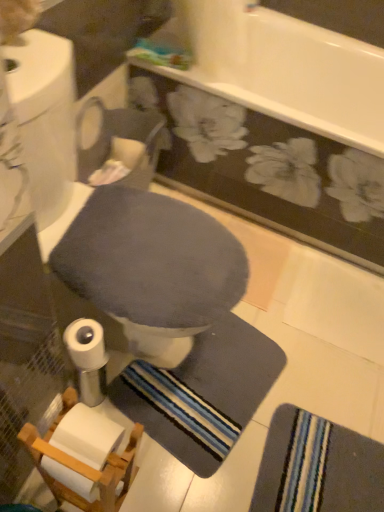
What do you see at coordinates (146, 269) in the screenshot?
I see `dark gray fabric toilet bowl at center` at bounding box center [146, 269].

Locate an element on the screen. The image size is (384, 512). dark gray fabric toilet bowl at center is located at coordinates (146, 269).

Where is `striped fabric bath towel at lower right`? The width and height of the screenshot is (384, 512). striped fabric bath towel at lower right is located at coordinates tap(317, 467).

Describe the element at coordinates (317, 467) in the screenshot. I see `striped fabric bath towel at lower right` at that location.

Identify the location of dark gray fabric toilet bowl at center. (146, 269).

Which is more to the right, striped fabric bath towel at lower right or dark gray fabric toilet bowl at center?

Positioned to the right is striped fabric bath towel at lower right.

Considering the positions of objects striped fabric bath towel at lower right and dark gray fabric toilet bowl at center in the image provided, who is in front, striped fabric bath towel at lower right or dark gray fabric toilet bowl at center?

Positioned in front is dark gray fabric toilet bowl at center.

Which point is more forward, (356,460) or (153,330)?

The point (153,330) is in front.

From the image's perspective, relative to dark gray fabric toilet bowl at center, is striped fabric bath towel at lower right above or below?

striped fabric bath towel at lower right is below dark gray fabric toilet bowl at center.

From a real-world perspective, is striped fabric bath towel at lower right over dark gray fabric toilet bowl at center?

No, from a real-world perspective, striped fabric bath towel at lower right is not on top of dark gray fabric toilet bowl at center.

Which object is thinner, striped fabric bath towel at lower right or dark gray fabric toilet bowl at center?

striped fabric bath towel at lower right.

Is striped fabric bath towel at lower right taller than dark gray fabric toilet bowl at center?

No.

Considering the sizes of objects striped fabric bath towel at lower right and dark gray fabric toilet bowl at center in the image provided, who is smaller, striped fabric bath towel at lower right or dark gray fabric toilet bowl at center?

striped fabric bath towel at lower right.

Could dark gray fabric toilet bowl at center be considered to be inside striped fabric bath towel at lower right?

No, dark gray fabric toilet bowl at center is not a part of striped fabric bath towel at lower right.

Is the surface of striped fabric bath towel at lower right in direct contact with dark gray fabric toilet bowl at center?

No, striped fabric bath towel at lower right is not in contact with dark gray fabric toilet bowl at center.

Looking at this image, is dark gray fabric toilet bowl at center at the back of striped fabric bath towel at lower right?

No, striped fabric bath towel at lower right is not facing away from dark gray fabric toilet bowl at center.

Can you tell me how much striped fabric bath towel at lower right and dark gray fabric toilet bowl at center differ in facing direction?

striped fabric bath towel at lower right and dark gray fabric toilet bowl at center are facing 179 degrees away from each other.

Locate an element on the screen. The width and height of the screenshot is (384, 512). toilet bowl on the left of striped fabric bath towel at lower right is located at coordinates (146, 269).

Does dark gray fabric toilet bowl at center appear on the left side of striped fabric bath towel at lower right?

Correct, you'll find dark gray fabric toilet bowl at center to the left of striped fabric bath towel at lower right.

Does dark gray fabric toilet bowl at center lie in front of striped fabric bath towel at lower right?

Yes, the depth of dark gray fabric toilet bowl at center is less than that of striped fabric bath towel at lower right.

Does point (112, 258) appear closer or farther from the camera than point (291, 469)?

Point (112, 258) appears to be closer to the viewer than point (291, 469).

From the image's perspective, between dark gray fabric toilet bowl at center and striped fabric bath towel at lower right, which one is located above?

dark gray fabric toilet bowl at center appears higher in the image.

From a real-world perspective, does dark gray fabric toilet bowl at center sit lower than striped fabric bath towel at lower right?

Actually, dark gray fabric toilet bowl at center is physically above striped fabric bath towel at lower right in the real world.

Which of these two, dark gray fabric toilet bowl at center or striped fabric bath towel at lower right, is wider?

With larger width is dark gray fabric toilet bowl at center.

Considering the sizes of objects dark gray fabric toilet bowl at center and striped fabric bath towel at lower right in the image provided, who is taller, dark gray fabric toilet bowl at center or striped fabric bath towel at lower right?

dark gray fabric toilet bowl at center.

Does dark gray fabric toilet bowl at center have a smaller size compared to striped fabric bath towel at lower right?

No.

From the picture: Is dark gray fabric toilet bowl at center spatially inside striped fabric bath towel at lower right, or outside of it?

dark gray fabric toilet bowl at center is spatially situated outside striped fabric bath towel at lower right.

Is there a large distance between dark gray fabric toilet bowl at center and striped fabric bath towel at lower right?

That's not correct — dark gray fabric toilet bowl at center is a little close to striped fabric bath towel at lower right.

Is dark gray fabric toilet bowl at center looking in the opposite direction of striped fabric bath towel at lower right?

No, dark gray fabric toilet bowl at center is not facing the opposite direction of striped fabric bath towel at lower right.

How many degrees apart are the facing directions of dark gray fabric toilet bowl at center and striped fabric bath towel at lower right?

The angle between the facing direction of dark gray fabric toilet bowl at center and the facing direction of striped fabric bath towel at lower right is 179 degrees.

How distant is dark gray fabric toilet bowl at center from striped fabric bath towel at lower right?

dark gray fabric toilet bowl at center and striped fabric bath towel at lower right are 23.14 inches apart.

Where is `toilet bowl on the left side of striped fabric bath towel at lower right`? The image size is (384, 512). toilet bowl on the left side of striped fabric bath towel at lower right is located at coordinates (146, 269).

Locate an element on the screen. The width and height of the screenshot is (384, 512). bath towel located on the right of dark gray fabric toilet bowl at center is located at coordinates (317, 467).

Where is `toilet bowl in front of the striped fabric bath towel at lower right`? This screenshot has height=512, width=384. toilet bowl in front of the striped fabric bath towel at lower right is located at coordinates (146, 269).